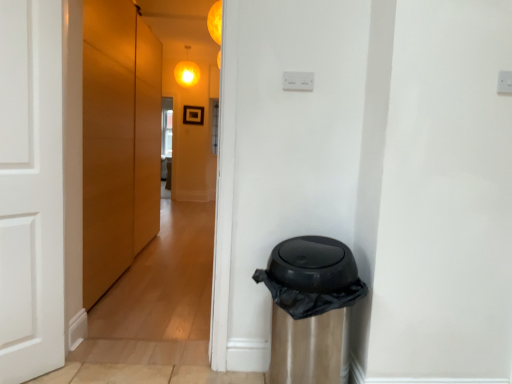
Question: Which direction should I rotate to face orange matte light at upper center, placed as the second light when sorted from left to right, — up or down?

Choices:
 (A) down
 (B) up

Answer: (B)

Question: Is black plastic waste bin at lower right in front of orange matte light at upper center, which is the first light in front-to-back order?

Choices:
 (A) no
 (B) yes

Answer: (B)

Question: Is black plastic waste bin at lower right bigger than orange matte light at upper center, arranged as the 2th light when viewed from the top?

Choices:
 (A) yes
 (B) no

Answer: (A)

Question: Are black plastic waste bin at lower right and orange matte light at upper center, the second light in the back-to-front sequence, making contact?

Choices:
 (A) no
 (B) yes

Answer: (A)

Question: Is black plastic waste bin at lower right not inside orange matte light at upper center, placed as the second light when sorted from left to right?

Choices:
 (A) yes
 (B) no

Answer: (A)

Question: Is black plastic waste bin at lower right facing away from orange matte light at upper center, marked as the first light in a right-to-left arrangement?

Choices:
 (A) yes
 (B) no

Answer: (B)

Question: Does black plastic waste bin at lower right turn towards orange matte light at upper center, which is the first light in front-to-back order?

Choices:
 (A) yes
 (B) no

Answer: (B)

Question: Are matte yellow globe at upper center, the second light in the bottom-to-top sequence, and matte wood door at left far apart?

Choices:
 (A) yes
 (B) no

Answer: (A)

Question: Is matte yellow globe at upper center, which is counted as the 2th light, starting from the front, placed right next to matte wood door at left?

Choices:
 (A) yes
 (B) no

Answer: (B)

Question: Considering the relative sizes of matte yellow globe at upper center, which ranks as the 1th light in top-to-bottom order, and matte wood door at left in the image provided, is matte yellow globe at upper center, which ranks as the 1th light in top-to-bottom order, shorter than matte wood door at left?

Choices:
 (A) no
 (B) yes

Answer: (B)

Question: Can you confirm if matte yellow globe at upper center, the second light in the bottom-to-top sequence, is thinner than matte wood door at left?

Choices:
 (A) no
 (B) yes

Answer: (A)

Question: Is the position of matte yellow globe at upper center, which ranks as the 1th light in top-to-bottom order, less distant than that of matte wood door at left?

Choices:
 (A) yes
 (B) no

Answer: (B)

Question: Is matte yellow globe at upper center, which is counted as the 2th light, starting from the front, at the left side of matte wood door at left?

Choices:
 (A) yes
 (B) no

Answer: (A)

Question: Is orange matte light at upper center, placed as the second light when sorted from left to right, outside of black plastic waste bin at lower right?

Choices:
 (A) no
 (B) yes

Answer: (B)